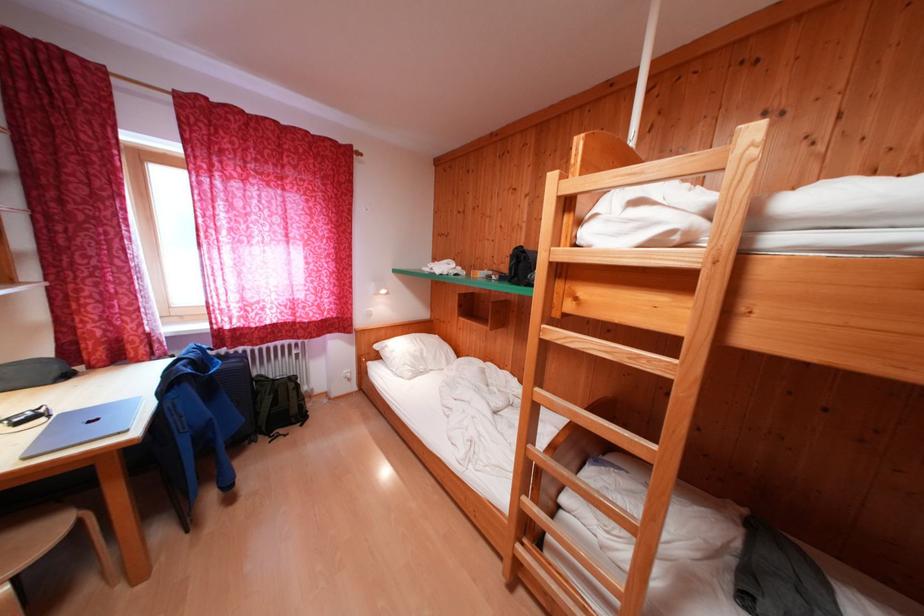
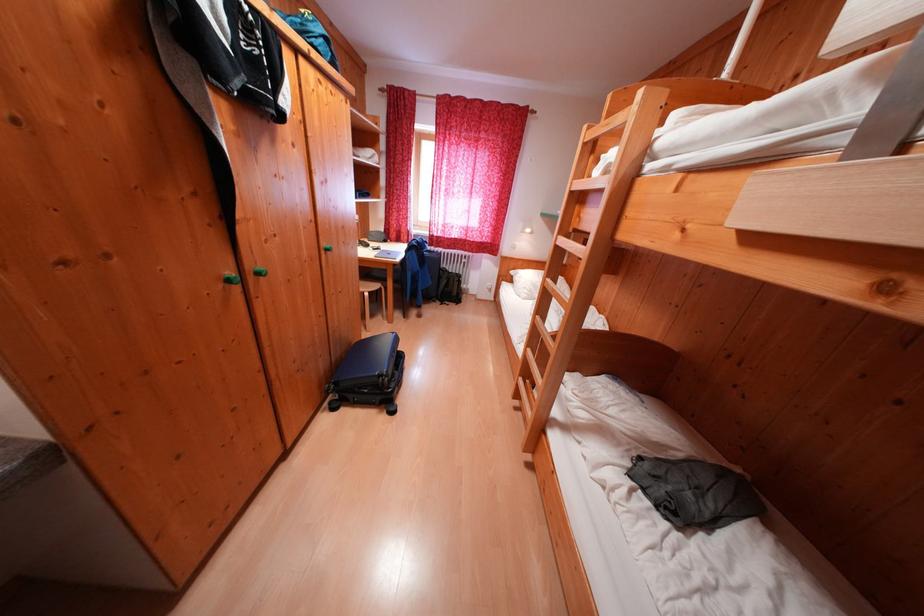
Locate, in the second image, the point that corresponds to point 385,361 in the first image.

(518, 284)